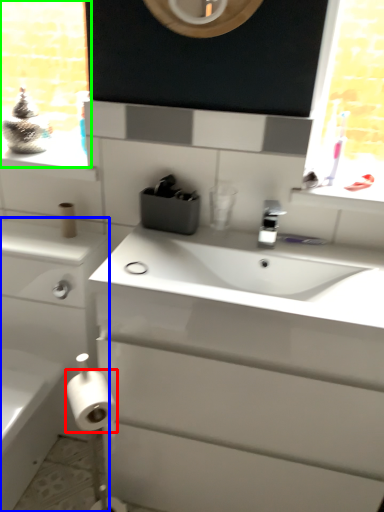
Question: Which object is positioned farthest from toilet paper (highlighted by a red box)? Select from bathroom cabinet (highlighted by a blue box) and window frame (highlighted by a green box).

Choices:
 (A) bathroom cabinet
 (B) window frame

Answer: (B)